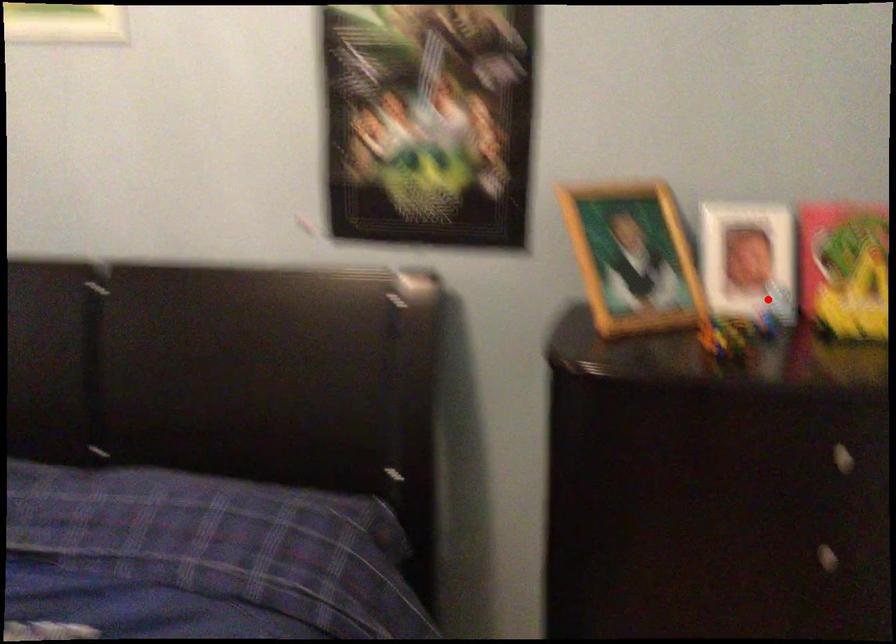
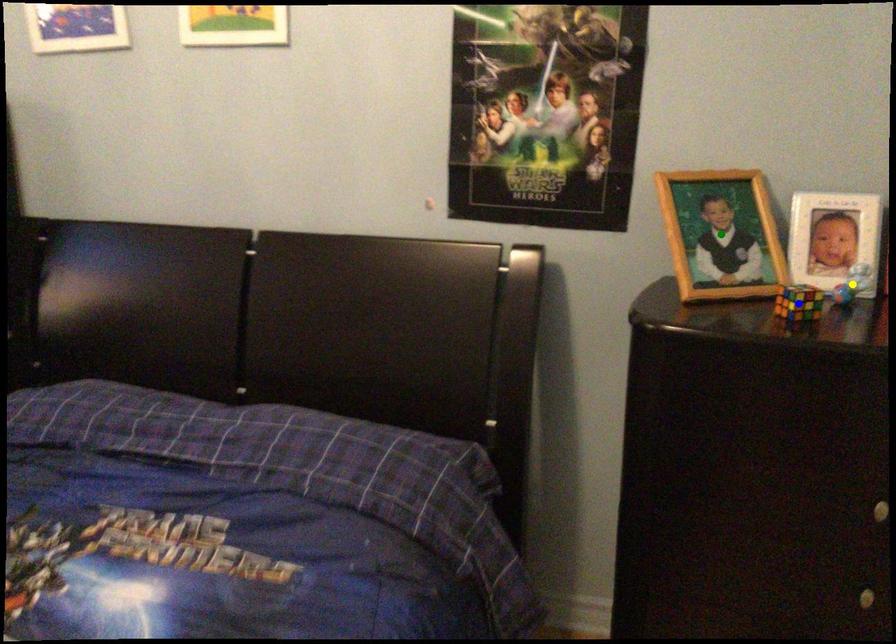
Question: I am providing you with two images of the same scene from different viewpoints. A red point is marked on the first image. You are given multiple points on the second image. Which point in image 2 represents the same 3d spot as the red point in image 1?

Choices:
 (A) yellow point
 (B) blue point
 (C) green point

Answer: (A)